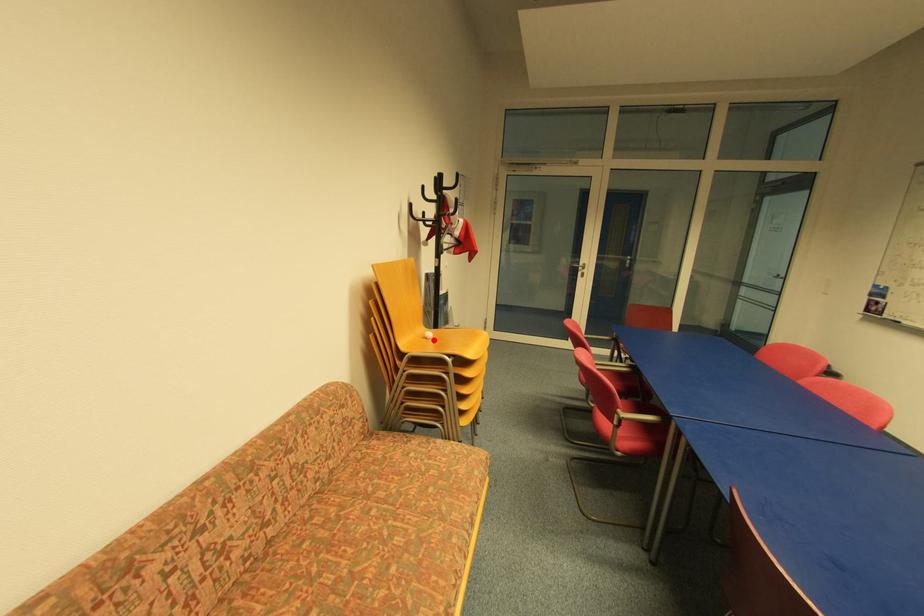
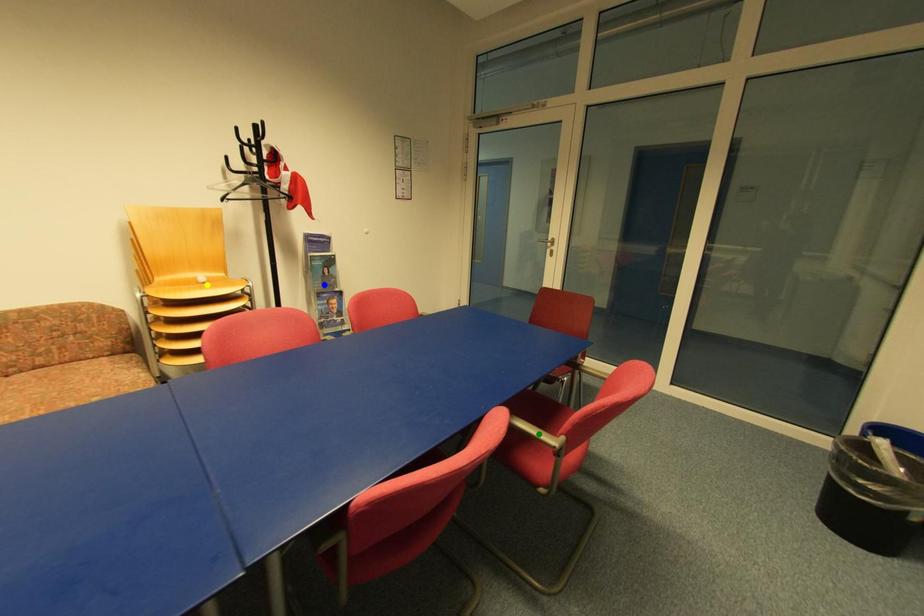
Question: I am providing you with two images of the same scene from different viewpoints. A red point is marked on the first image. You are given multiple points on the second image. Can you choose the point in image 2 that corresponds to the point in image 1?

Choices:
 (A) blue point
 (B) yellow point
 (C) green point

Answer: (B)